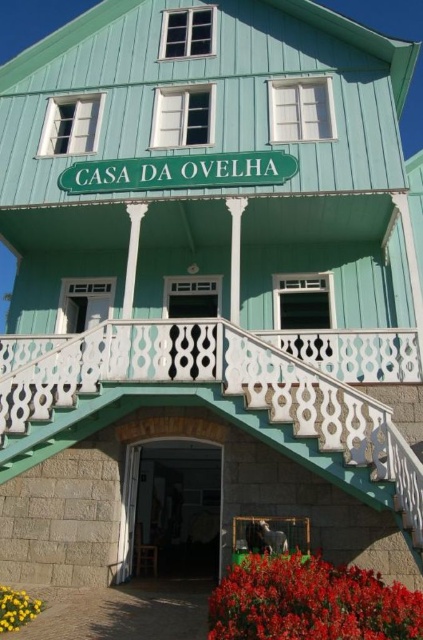
You are standing at the entrance of the two story building painted in a vibrant shade of turquoise. You want to place a decorative item at the exact center of the building. However, there are already vivid red petals at lower center. Where should you place the new item so that it is centered and not overlapping with the petals?

The exact center of the building would be at point coordinates different from the vivid red petals at lower center, which are located at point (310,602). To place the new item centrally without overlapping, position it at the true center coordinates of the building.

You are a painter who needs to decide which object to paint first between the wooden door at center and the yellow matte flower at lower left. Which object should you paint first if you want to start with the taller one?

The wooden door at center is taller than the yellow matte flower at lower left, so you should paint the wooden door at center first.